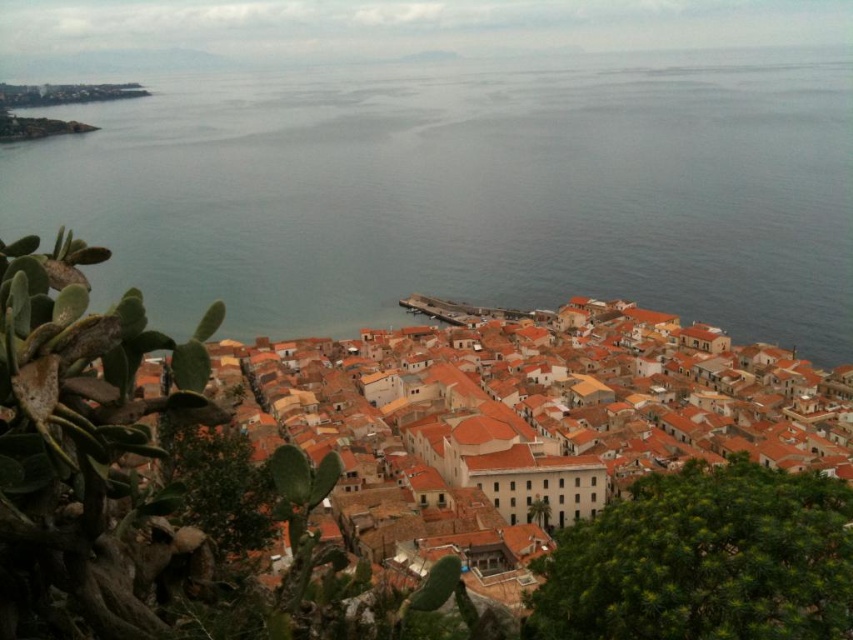
You are a delivery drone with a maximum flight range of 150 meters. You need to deliver a package from the smooth blue water at center to the orange clay rooftops at center. Can you complete the delivery without needing a recharge?

The distance between the smooth blue water at center and the orange clay rooftops at center is 179.04 meters, which exceeds the drone s 150 meter range. Therefore, the drone cannot complete the delivery without recharging.

Based on the scene description, what does the point at coordinates (467,189) represent?

The point at coordinates (467,189) represents the smooth blue water at center.

You are a tourist standing at the edge of the coastal town and want to take a photo that includes both the smooth blue water at center and the orange clay rooftops at center. Which object should you place on the left side of your photo to ensure both are visible?

To ensure both the smooth blue water at center and the orange clay rooftops at center are visible in your photo, you should position the smooth blue water at center on the left side since it is already on the left of the orange clay rooftops at center.